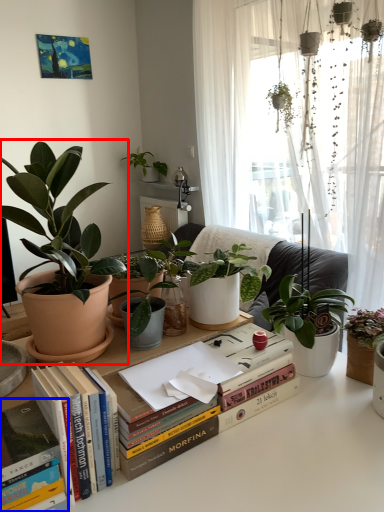
Question: Which object is closer to the camera taking this photo, houseplant (highlighted by a red box) or paperback book (highlighted by a blue box)?

Choices:
 (A) houseplant
 (B) paperback book

Answer: (B)